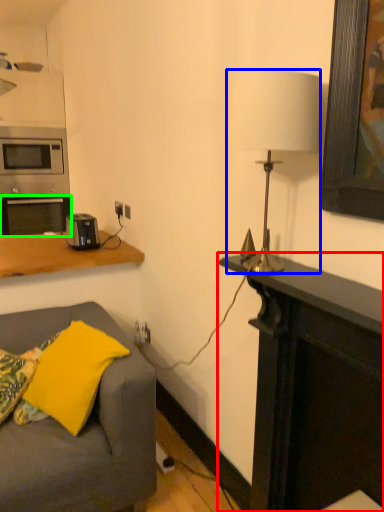
Question: Based on their relative distances, which object is farther from desk (highlighted by a red box)? Choose from lamp (highlighted by a blue box) and oven (highlighted by a green box).

Choices:
 (A) lamp
 (B) oven

Answer: (B)